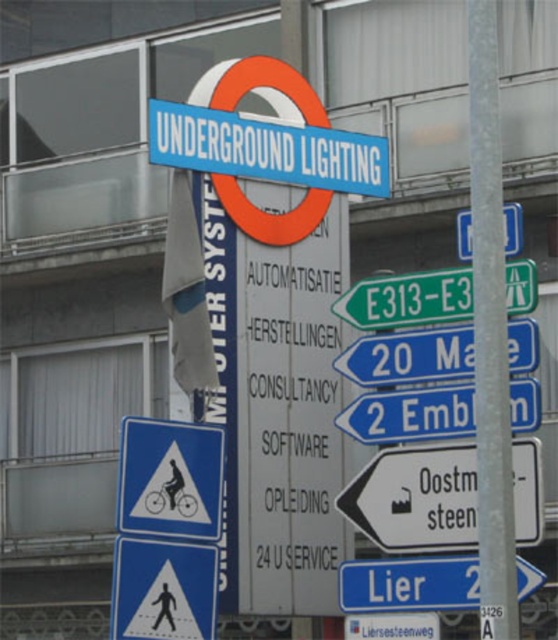
You are a pedestrian standing on the sidewalk and see the white plastic pedestrian crossing sign at lower left and the white plastic road sign at center. Which sign is positioned more to the left?

The white plastic pedestrian crossing sign at lower left is positioned more to the left than the white plastic road sign at center.

What are the coordinates of the silver metallic pole at center?

The silver metallic pole at center is located at point (489,333).